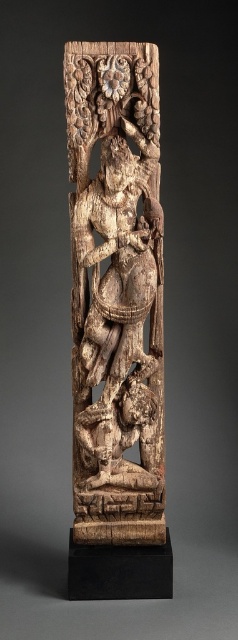
Can you confirm if carved wood sculpture at center is shorter than carved wood figure at lower center?

Incorrect, carved wood sculpture at center's height does not fall short of carved wood figure at lower center's.

Can you confirm if carved wood sculpture at center is positioned to the left of carved wood figure at lower center?

Yes, carved wood sculpture at center is to the left of carved wood figure at lower center.

Describe the element at coordinates (115, 292) in the screenshot. This screenshot has width=238, height=640. I see `carved wood sculpture at center` at that location.

This screenshot has height=640, width=238. Find the location of `carved wood sculpture at center`. carved wood sculpture at center is located at coordinates (115, 292).